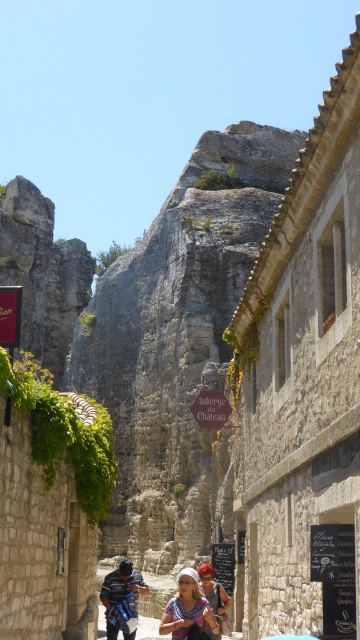
Question: Which of these objects is positioned closest to the blue denim jacket at center?

Choices:
 (A) gray stone rock at center
 (B) blonde hair at center
 (C) matte white shirt at center

Answer: (C)

Question: Does gray stone rock at center appear over blonde hair at center?

Choices:
 (A) no
 (B) yes

Answer: (B)

Question: Which object appears farthest from the camera in this image?

Choices:
 (A) blue denim jacket at center
 (B) matte white shirt at center

Answer: (A)

Question: Which point appears farthest from the camera in this image?

Choices:
 (A) (204, 593)
 (B) (125, 595)

Answer: (A)

Question: Does blonde hair at center appear under matte white shirt at center?

Choices:
 (A) yes
 (B) no

Answer: (A)

Question: Is gray stone rock at center below matte white shirt at center?

Choices:
 (A) yes
 (B) no

Answer: (B)